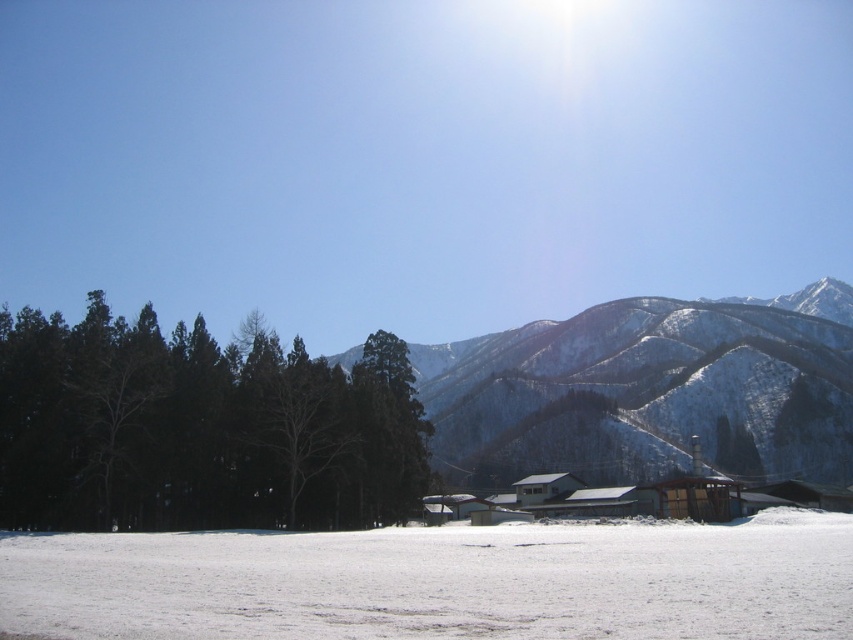
Question: Does green matte trees at left appear on the right side of green matte tree at center?

Choices:
 (A) no
 (B) yes

Answer: (A)

Question: Among these objects, which one is farthest from the camera?

Choices:
 (A) green matte trees at left
 (B) green matte tree at center

Answer: (B)

Question: Considering the real-world distances, which object is closest to the snowy textured mountain at center?

Choices:
 (A) green matte tree at center
 (B) green matte trees at left

Answer: (B)

Question: Does white snow at lower center have a lesser width compared to green matte trees at left?

Choices:
 (A) yes
 (B) no

Answer: (B)

Question: Does green matte trees at left appear under snowy textured mountain at center?

Choices:
 (A) no
 (B) yes

Answer: (B)

Question: Which point is farther to the camera?

Choices:
 (A) pos(386,435)
 (B) pos(727,394)
 (C) pos(372,420)
 (D) pos(312,547)

Answer: (B)